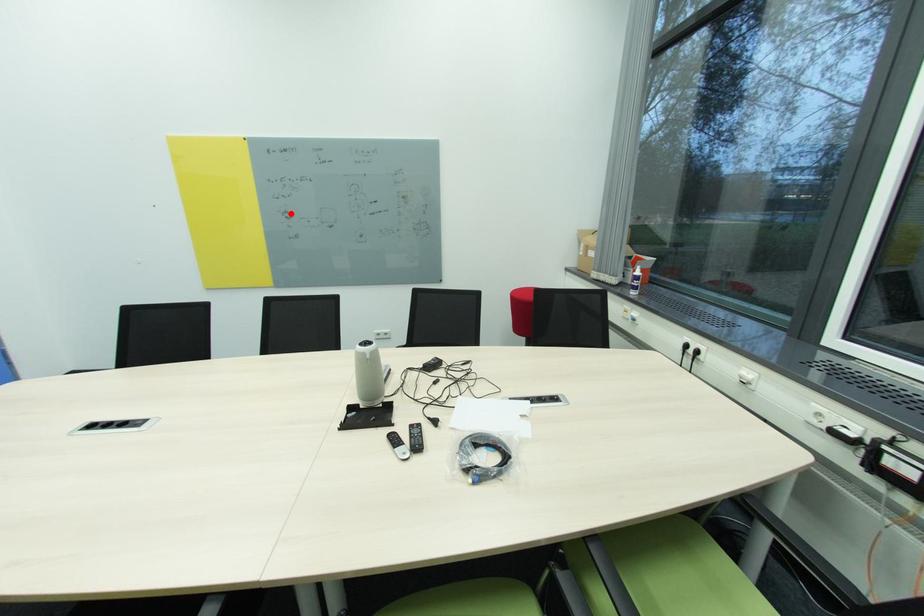
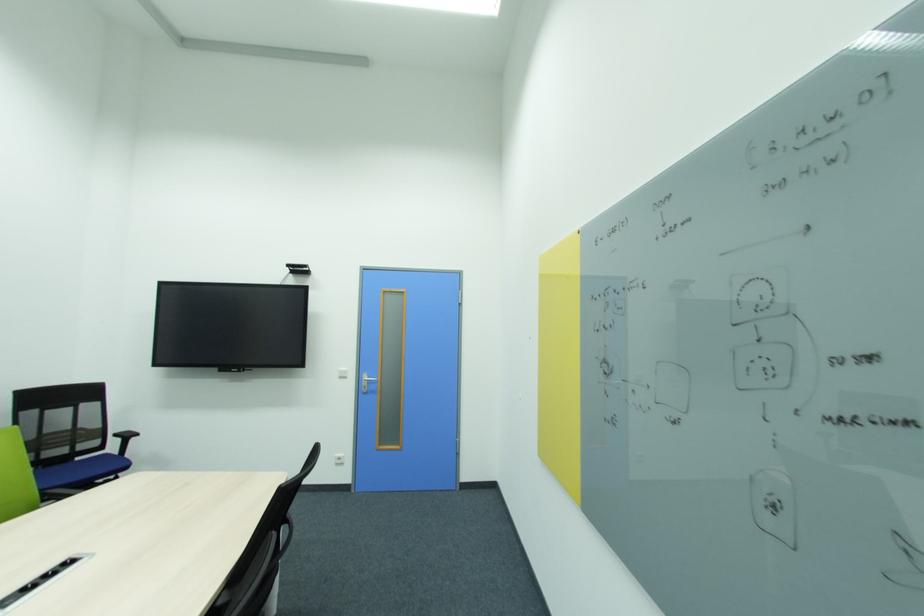
Find the pixel in the second image that matches the highlighted location in the first image.

(610, 362)